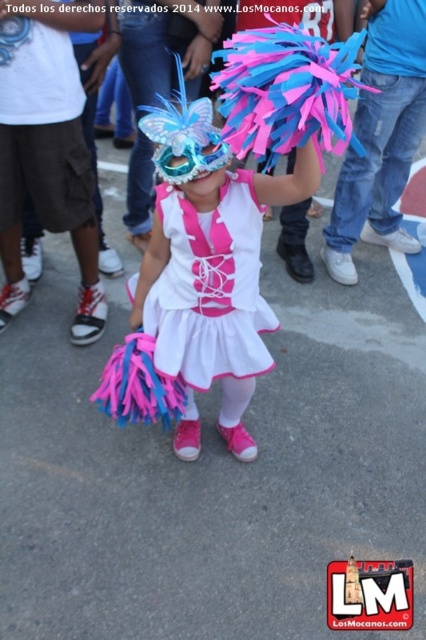
You are a photographer taking a picture of the matte plastic mask at center and the white satin dress at center. Which object will appear closer to the camera in the photo?

The matte plastic mask at center is in front of the white satin dress at center, so it will appear closer to the camera in the photo.

You are standing at the origin point in the image and want to move towards the child holding the pom poms. Which point should you walk through first, point (209, 152) or point (238, 372)?

Point (209, 152) is in front of point (238, 372), so you should walk through point (209, 152) first.

You are a photographer trying to capture a clear shot of both the pink satin ballet skirt at center and the white satin dress at center. Since the camera can only focus on one object at a time, which object should you choose to ensure the other remains somewhat in the background?

You should focus on the pink satin ballet skirt at center because it is closer to the viewer than the white satin dress at center, which will naturally appear in the background.